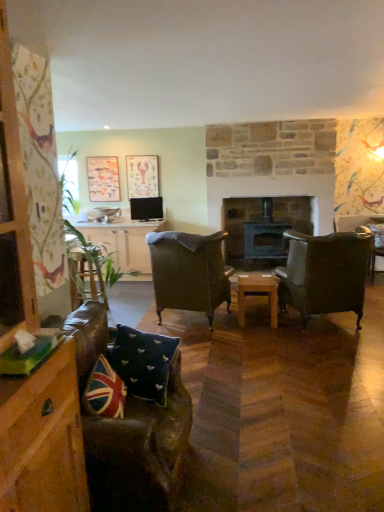
Describe the element at coordinates (189, 272) in the screenshot. I see `dark brown leather chair at center, acting as the second chair starting from the back` at that location.

Where is `dark brown leather chair at center, the 1th chair in the left-to-right sequence`? This screenshot has width=384, height=512. dark brown leather chair at center, the 1th chair in the left-to-right sequence is located at coordinates (189, 272).

Locate an element on the screen. The width and height of the screenshot is (384, 512). dark brown wood fireplace at center is located at coordinates (264, 225).

The image size is (384, 512). What do you see at coordinates (104, 391) in the screenshot? I see `union jack fabric pillow at lower left, acting as the second pillow starting from the back` at bounding box center [104, 391].

Where is `union jack fabric pillow at lower left, which appears as the first pillow when viewed from the front`? union jack fabric pillow at lower left, which appears as the first pillow when viewed from the front is located at coordinates (104, 391).

What is the approximate width of wooden table at center?

It is 17.53 inches.

What do you see at coordinates (258, 293) in the screenshot? I see `wooden table at center` at bounding box center [258, 293].

Identify the location of leather armchair at right, the third chair viewed from the back. (325, 273).

This screenshot has width=384, height=512. I want to click on velvet union jack pillow at lower left, the 2th pillow when ordered from front to back, so click(x=142, y=361).

Between velvet green armchair at right, marked as the 1th chair in a back-to-front arrangement, and matte wooden picture frame at upper left, the first picture frame positioned from the left, which one appears on the right side from the viewer's perspective?

velvet green armchair at right, marked as the 1th chair in a back-to-front arrangement.

From the picture: Does velvet green armchair at right, positioned as the third chair in front-to-back order, turn towards matte wooden picture frame at upper left, the first picture frame positioned from the left?

No, velvet green armchair at right, positioned as the third chair in front-to-back order, is not facing towards matte wooden picture frame at upper left, the first picture frame positioned from the left.

Does velvet green armchair at right, which ranks as the 3th chair in left-to-right order, have a lesser height compared to matte wooden picture frame at upper left, arranged as the 2th picture frame when viewed from the right?

Incorrect, the height of velvet green armchair at right, which ranks as the 3th chair in left-to-right order, does not fall short of that of matte wooden picture frame at upper left, arranged as the 2th picture frame when viewed from the right.

Can you tell me how much velvet green armchair at right, which ranks as the 3th chair in left-to-right order, and matte wooden picture frame at upper left, arranged as the 2th picture frame when viewed from the right, differ in facing direction?

The angle between the facing direction of velvet green armchair at right, which ranks as the 3th chair in left-to-right order, and the facing direction of matte wooden picture frame at upper left, arranged as the 2th picture frame when viewed from the right, is 0.857 degrees.

Is point (339, 249) farther from camera compared to point (157, 162)?

That is False.

Is leather armchair at right, the 2th chair in the right-to-left sequence, wider or thinner than matte pink paper at upper center, which is counted as the 1th picture frame, starting from the right?

Considering their sizes, leather armchair at right, the 2th chair in the right-to-left sequence, looks broader than matte pink paper at upper center, which is counted as the 1th picture frame, starting from the right.

From the image's perspective, who appears lower, leather armchair at right, the second chair positioned from the left, or matte pink paper at upper center, the second picture frame viewed from the left?

leather armchair at right, the second chair positioned from the left.

At what (x,y) coordinates should I click in order to perform the action: click on picture frame that is the 1st one when counting leftward from the leather armchair at right, the third chair viewed from the back. Please return your answer as a coordinate pair (x, y). The width and height of the screenshot is (384, 512). Looking at the image, I should click on (142, 176).

Does point (178, 381) come behind point (377, 245)?

No, (178, 381) is in front of (377, 245).

Is velvet green armchair at right, the 1th chair when ordered from right to left, completely or partially inside leather couch at lower left?

Definitely not — velvet green armchair at right, the 1th chair when ordered from right to left, is not inside leather couch at lower left.

Can you confirm if leather couch at lower left is shorter than velvet green armchair at right, the 1th chair when ordered from right to left?

Indeed, leather couch at lower left has a lesser height compared to velvet green armchair at right, the 1th chair when ordered from right to left.

In the scene shown: Considering the sizes of leather couch at lower left and velvet green armchair at right, which ranks as the 3th chair in left-to-right order, in the image, is leather couch at lower left wider or thinner than velvet green armchair at right, which ranks as the 3th chair in left-to-right order,?

leather couch at lower left is wider than velvet green armchair at right, which ranks as the 3th chair in left-to-right order.

Is matte wooden picture frame at upper left, the first picture frame positioned from the left, oriented away from leather couch at lower left?

matte wooden picture frame at upper left, the first picture frame positioned from the left, does not have its back to leather couch at lower left.

Is matte wooden picture frame at upper left, arranged as the 2th picture frame when viewed from the right, inside or outside of leather couch at lower left?

matte wooden picture frame at upper left, arranged as the 2th picture frame when viewed from the right, lies outside leather couch at lower left.

From the image's perspective, is matte wooden picture frame at upper left, the first picture frame positioned from the left, below leather couch at lower left?

No.

How different are the orientations of dark brown wood fireplace at center and velvet union jack pillow at lower left, the 2th pillow when ordered from front to back, in degrees?

They differ by 0.936 degrees in their facing directions.

Which point is more forward, [238,219] or [158,361]?

The point [158,361] is closer.

Where is `pillow that is the 1st one when counting leftward from the dark brown wood fireplace at center`? Image resolution: width=384 pixels, height=512 pixels. pillow that is the 1st one when counting leftward from the dark brown wood fireplace at center is located at coordinates (142, 361).

Is dark brown wood fireplace at center oriented away from velvet union jack pillow at lower left, acting as the 1th pillow starting from the back?

No, dark brown wood fireplace at center is not facing the opposite direction of velvet union jack pillow at lower left, acting as the 1th pillow starting from the back.

Considering the relative sizes of leather couch at lower left and matte pink paper at upper center, the second picture frame viewed from the left, in the image provided, is leather couch at lower left smaller than matte pink paper at upper center, the second picture frame viewed from the left,?

Incorrect, leather couch at lower left is not smaller in size than matte pink paper at upper center, the second picture frame viewed from the left.

Is leather couch at lower left inside or outside of matte pink paper at upper center, the second picture frame viewed from the left?

leather couch at lower left is not enclosed by matte pink paper at upper center, the second picture frame viewed from the left.

Between leather couch at lower left and matte pink paper at upper center, the second picture frame viewed from the left, which one has more height?

Standing taller between the two is leather couch at lower left.

From a real-world perspective, between leather couch at lower left and matte pink paper at upper center, the second picture frame viewed from the left, who is vertically higher?

From a 3D spatial view, matte pink paper at upper center, the second picture frame viewed from the left, is above.

Would you consider wooden table at center to be distant from leather couch at lower left?

Absolutely, wooden table at center is distant from leather couch at lower left.

Which object is thinner, wooden table at center or leather couch at lower left?

wooden table at center.

Between wooden table at center and leather couch at lower left, which one is positioned behind?

wooden table at center is further away from the camera.

Is point (247, 288) closer to camera compared to point (173, 366)?

No, it is not.

What are the coordinates of `the 1st chair below the matte wooden picture frame at upper left, arranged as the 2th picture frame when viewed from the right (from the image's perspective)` in the screenshot? It's located at (376, 244).

In order to click on chair that is the 3rd object located in front of the matte pink paper at upper center, which is counted as the 1th picture frame, starting from the right in this screenshot , I will do `click(325, 273)`.

Looking at the image, which one is located further to leather couch at lower left, wooden table at center or matte pink paper at upper center, the second picture frame viewed from the left?

matte pink paper at upper center, the second picture frame viewed from the left, lies further to leather couch at lower left than the other object.

Considering their positions, is matte pink paper at upper center, which is counted as the 1th picture frame, starting from the right, positioned further to leather couch at lower left than dark brown wood fireplace at center?

matte pink paper at upper center, which is counted as the 1th picture frame, starting from the right, is positioned further to the anchor leather couch at lower left.

Estimate the real-world distances between objects in this image. Which object is closer to matte pink paper at upper center, the second picture frame viewed from the left, velvet union jack pillow at lower left, the 2th pillow when ordered from front to back, or dark brown leather chair at center, acting as the second chair starting from the back?

dark brown leather chair at center, acting as the second chair starting from the back, lies closer to matte pink paper at upper center, the second picture frame viewed from the left, than the other object.

From the image, which object appears to be nearer to velvet union jack pillow at lower left, acting as the 1th pillow starting from the back, matte wooden picture frame at upper left, the first picture frame positioned from the left, or wooden table at center?

wooden table at center is positioned closer to the anchor velvet union jack pillow at lower left, acting as the 1th pillow starting from the back.

Based on the photo, looking at the image, which one is located closer to matte pink paper at upper center, which is counted as the 1th picture frame, starting from the right, union jack fabric pillow at lower left, acting as the second pillow starting from the back, or velvet union jack pillow at lower left, the 2th pillow when ordered from front to back?

The object closer to matte pink paper at upper center, which is counted as the 1th picture frame, starting from the right, is velvet union jack pillow at lower left, the 2th pillow when ordered from front to back.

From the picture: When comparing their distances from union jack fabric pillow at lower left, acting as the second pillow starting from the back, does matte wooden picture frame at upper left, the first picture frame positioned from the left, or velvet union jack pillow at lower left, the 2th pillow when ordered from front to back, seem closer?

The object closer to union jack fabric pillow at lower left, acting as the second pillow starting from the back, is velvet union jack pillow at lower left, the 2th pillow when ordered from front to back.

Which object lies nearer to the anchor point wooden table at center, leather armchair at right, the 2th chair in the right-to-left sequence, or matte wooden picture frame at upper left, the first picture frame positioned from the left?

Among the two, leather armchair at right, the 2th chair in the right-to-left sequence, is located nearer to wooden table at center.

When comparing their distances from leather armchair at right, the 1th chair when ordered from front to back, does velvet union jack pillow at lower left, acting as the 1th pillow starting from the back, or union jack fabric pillow at lower left, acting as the second pillow starting from the back, seem closer?

velvet union jack pillow at lower left, acting as the 1th pillow starting from the back.

At what (x,y) coordinates should I click in order to perform the action: click on table between union jack fabric pillow at lower left, acting as the second pillow starting from the back, and matte pink paper at upper center, the second picture frame viewed from the left, in the front-back direction. Please return your answer as a coordinate pair (x, y). The width and height of the screenshot is (384, 512). Looking at the image, I should click on (258, 293).

Locate an element on the screen. table located between leather armchair at right, the second chair positioned from the left, and velvet green armchair at right, marked as the 1th chair in a back-to-front arrangement, in the depth direction is located at coordinates (258, 293).

Locate an element on the screen. The height and width of the screenshot is (512, 384). table between leather armchair at right, the 1th chair when ordered from front to back, and matte wooden picture frame at upper left, the first picture frame positioned from the left, along the z-axis is located at coordinates (258, 293).

You are a GUI agent. You are given a task and a screenshot of the screen. Output one action in this format:
    pyautogui.click(x=<x>, y=<y>)
    Task: Click on the picture frame between velvet union jack pillow at lower left, acting as the 1th pillow starting from the back, and matte wooden picture frame at upper left, arranged as the 2th picture frame when viewed from the right, along the z-axis
    Image resolution: width=384 pixels, height=512 pixels.
    Given the screenshot: What is the action you would take?
    pyautogui.click(x=142, y=176)